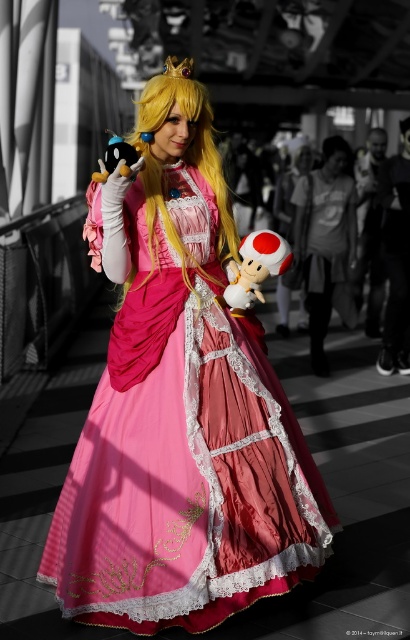
Question: Does matte pink dress at center appear on the left side of golden silky hair at center?

Choices:
 (A) yes
 (B) no

Answer: (B)

Question: Which object is farther from the camera taking this photo?

Choices:
 (A) golden silky hair at center
 (B) white plush toy at center
 (C) matte pink dress at center

Answer: (A)

Question: Is golden silky hair at center wider than white plush toy at center?

Choices:
 (A) no
 (B) yes

Answer: (B)

Question: Which object is positioned closest to the white plush toy at center?

Choices:
 (A) golden silky hair at center
 (B) matte pink dress at center

Answer: (A)

Question: Which is farther from the white plush toy at center?

Choices:
 (A) golden silky hair at center
 (B) matte pink dress at center

Answer: (B)

Question: Does matte pink dress at center have a lesser width compared to white plush toy at center?

Choices:
 (A) no
 (B) yes

Answer: (A)